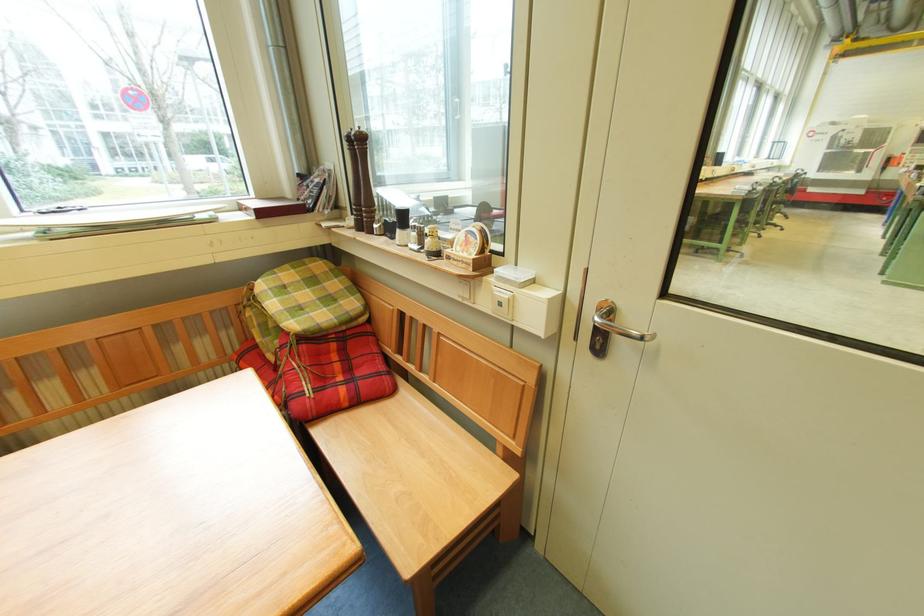
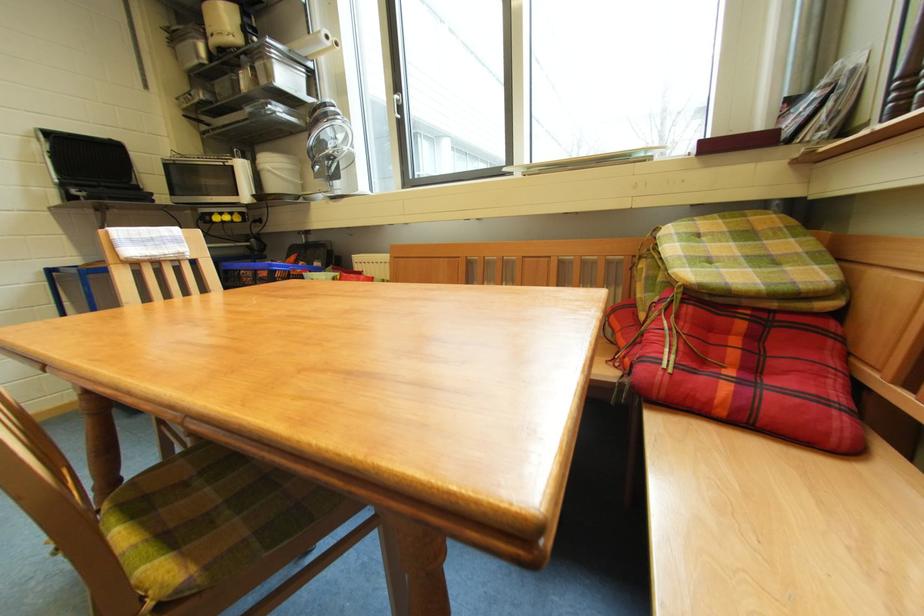
Where in the second image is the point corresponding to point (295, 268) from the first image?

(723, 219)